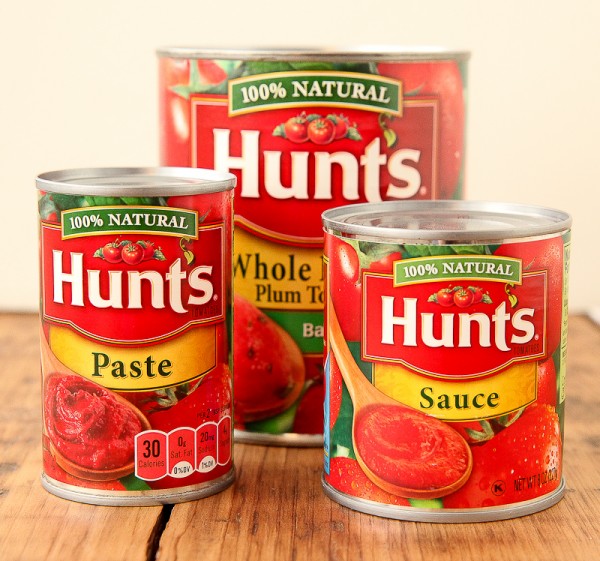
You are a GUI agent. You are given a task and a screenshot of the screen. Output one action in this format:
    pyautogui.click(x=<x>, y=<y>)
    Task: Click on the wall
    
    Given the screenshot: What is the action you would take?
    pyautogui.click(x=100, y=79)